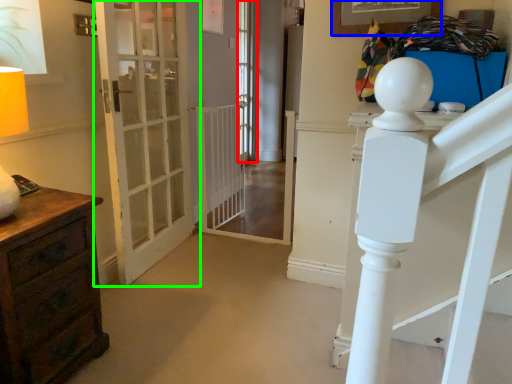
Question: Estimate the real-world distances between objects in this image. Which object is closer to window (highlighted by a red box), picture frame (highlighted by a blue box) or door (highlighted by a green box)?

Choices:
 (A) picture frame
 (B) door

Answer: (B)